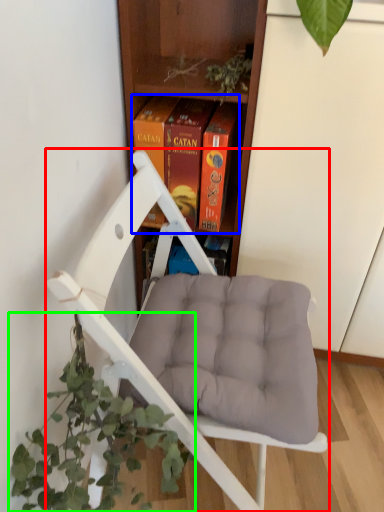
Question: Based on their relative distances, which object is farther from chair (highlighted by a red box)? Choose from book (highlighted by a blue box) and houseplant (highlighted by a green box).

Choices:
 (A) book
 (B) houseplant

Answer: (A)